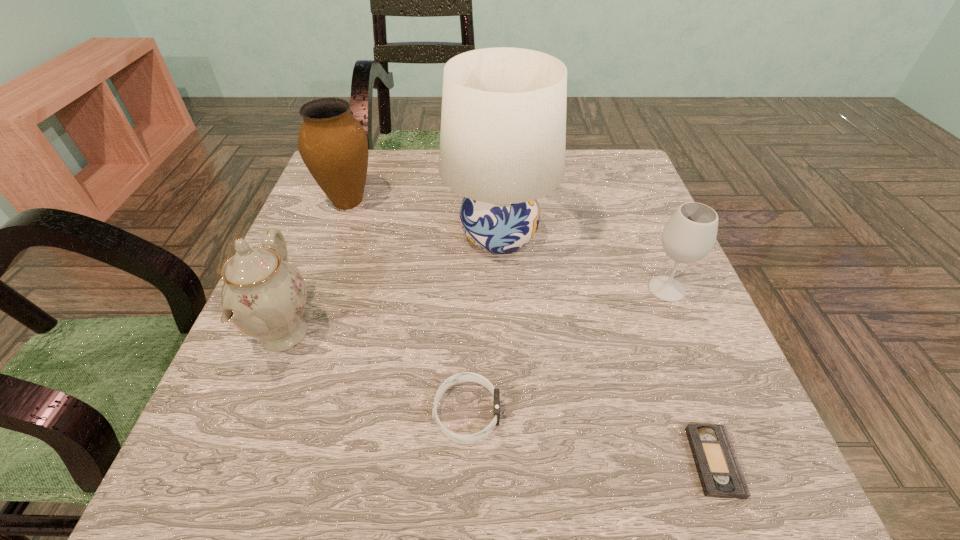
Where is `empty space that is in between the wristband and the chinaware`? empty space that is in between the wristband and the chinaware is located at coordinates (375, 373).

I want to click on free spot between the chinaware and the urn, so click(316, 268).

This screenshot has height=540, width=960. In order to click on free space that is in between the wristband and the wineglass in this screenshot , I will do `click(566, 350)`.

You are a GUI agent. You are given a task and a screenshot of the screen. Output one action in this format:
    pyautogui.click(x=<x>, y=<y>)
    Task: Click on the free space between the third shortest object and the chinaware
    Image resolution: width=960 pixels, height=540 pixels.
    Given the screenshot: What is the action you would take?
    pyautogui.click(x=475, y=312)

Find the location of `vacant space that's between the urn and the chinaware`. vacant space that's between the urn and the chinaware is located at coordinates (316, 268).

I want to click on free space that is in between the second shortest object and the chinaware, so click(x=375, y=373).

Select which object appears as the fourth closest to the tallest object. Please provide its 2D coordinates. Your answer should be formatted as a tuple, i.e. [(x, y)], where the tuple contains the x and y coordinates of a point satisfying the conditions above.

[(464, 376)]

This screenshot has width=960, height=540. Find the location of `object that is the second closest to the third shortest object`. object that is the second closest to the third shortest object is located at coordinates (719, 471).

Locate an element on the screen. vacant area in the image that satisfies the following two spatial constraints: 1. on the front side of the wineglass; 2. on the outer surface of the wristband is located at coordinates (717, 413).

The image size is (960, 540). I want to click on vacant space that satisfies the following two spatial constraints: 1. on the front-facing side of the tallest object; 2. on the back side of the shortest object, so click(510, 462).